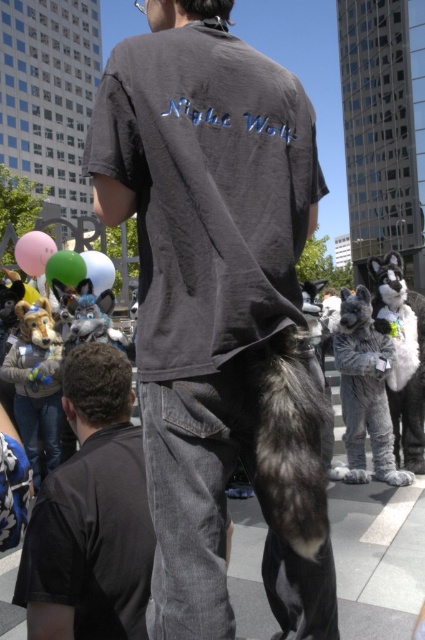
Which is more to the left, pink rubber balloon at lower left or white glossy balloon at center?

pink rubber balloon at lower left is more to the left.

Locate an element on the screen. Image resolution: width=425 pixels, height=640 pixels. pink rubber balloon at lower left is located at coordinates (34, 252).

The width and height of the screenshot is (425, 640). I want to click on pink rubber balloon at lower left, so click(x=34, y=252).

Can you confirm if dark gray t-shirt at center is positioned below green rubber balloon at center?

Indeed, dark gray t-shirt at center is positioned under green rubber balloon at center.

Between point (214, 470) and point (85, 266), which one is positioned in front?

Point (214, 470) is in front.

The width and height of the screenshot is (425, 640). I want to click on dark gray t-shirt at center, so click(x=218, y=308).

Is point (340, 333) closer to viewer compared to point (373, 260)?

That is True.

Can you confirm if fuzzy gray wolf at center is smaller than gray furry dog at right?

Correct, fuzzy gray wolf at center occupies less space than gray furry dog at right.

Is point (388, 353) more distant than point (379, 264)?

No, (388, 353) is closer to viewer.

Where is `fuzzy gray wolf at center`? fuzzy gray wolf at center is located at coordinates (365, 390).